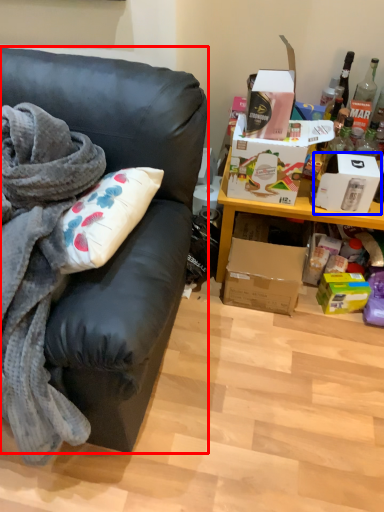
Question: Which object is closer to the camera taking this photo, studio couch (highlighted by a red box) or box (highlighted by a blue box)?

Choices:
 (A) studio couch
 (B) box

Answer: (A)